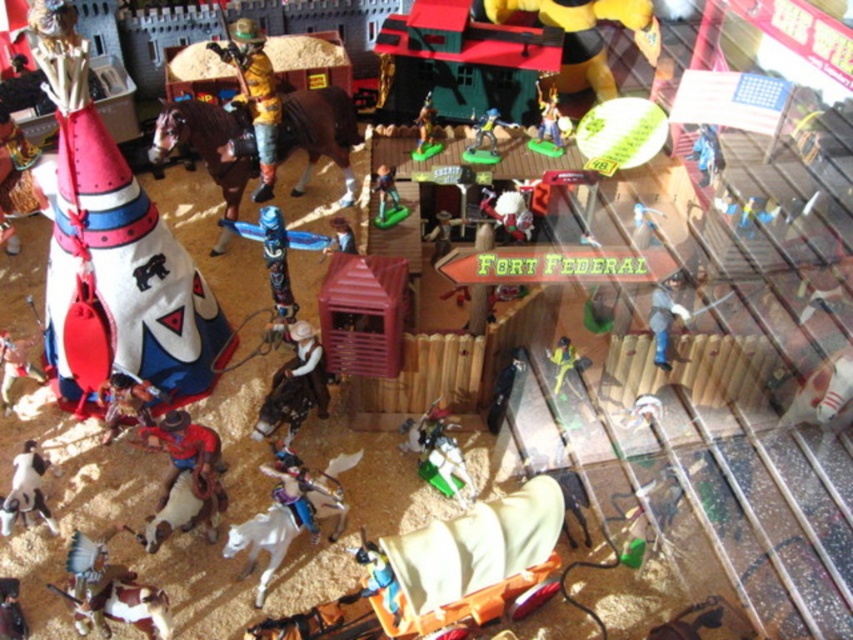
Between wooden totem pole at center and white matte horse at lower left, which one has more height?

Standing taller between the two is wooden totem pole at center.

Can you confirm if wooden totem pole at center is taller than white matte horse at lower left?

Yes.

Who is more forward, (229, 220) or (15, 513)?

Positioned in front is point (15, 513).

At what (x,y) coordinates should I click in order to perform the action: click on wooden totem pole at center. Please return your answer as a coordinate pair (x, y). The width and height of the screenshot is (853, 640). Looking at the image, I should click on (277, 253).

Can you confirm if green plastic cowboy at center is shorter than matte plastic cowboy at center?

In fact, green plastic cowboy at center may be taller than matte plastic cowboy at center.

Between green plastic cowboy at center and matte plastic cowboy at center, which one has more height?

green plastic cowboy at center

Which is in front, point (399, 216) or point (338, 236)?

Point (338, 236) is more forward.

Image resolution: width=853 pixels, height=640 pixels. I want to click on green plastic cowboy at center, so click(x=387, y=198).

Does white fur horse at lower center have a smaller size compared to green plastic toy at lower right?

No.

Who is shorter, white fur horse at lower center or green plastic toy at lower right?

With less height is green plastic toy at lower right.

Between point (149, 516) and point (570, 364), which one is positioned behind?

The point (570, 364) is more distant.

You are a GUI agent. You are given a task and a screenshot of the screen. Output one action in this format:
    pyautogui.click(x=<x>, y=<y>)
    Task: Click on the white fur horse at lower center
    The width and height of the screenshot is (853, 640).
    Given the screenshot: What is the action you would take?
    pyautogui.click(x=184, y=508)